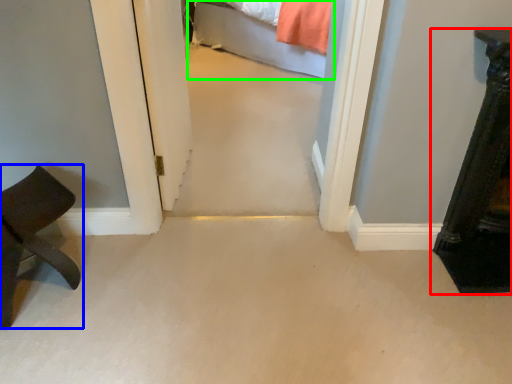
Question: Estimate the real-world distances between objects in this image. Which object is closer to furniture (highlighted by a red box), furniture (highlighted by a blue box) or bed (highlighted by a green box)?

Choices:
 (A) furniture
 (B) bed

Answer: (A)